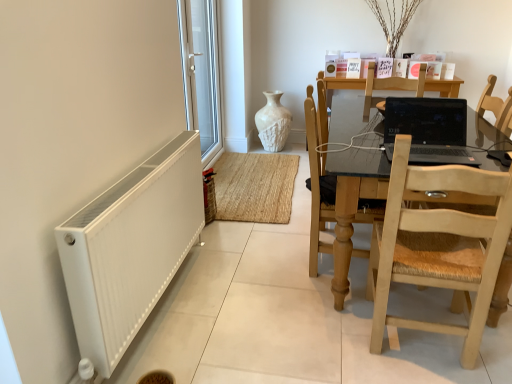
This screenshot has height=384, width=512. I want to click on vacant space in between light brown wooden chair at center, arranged as the 2th chair when viewed from the front, and white matte radiator at lower left, so click(250, 296).